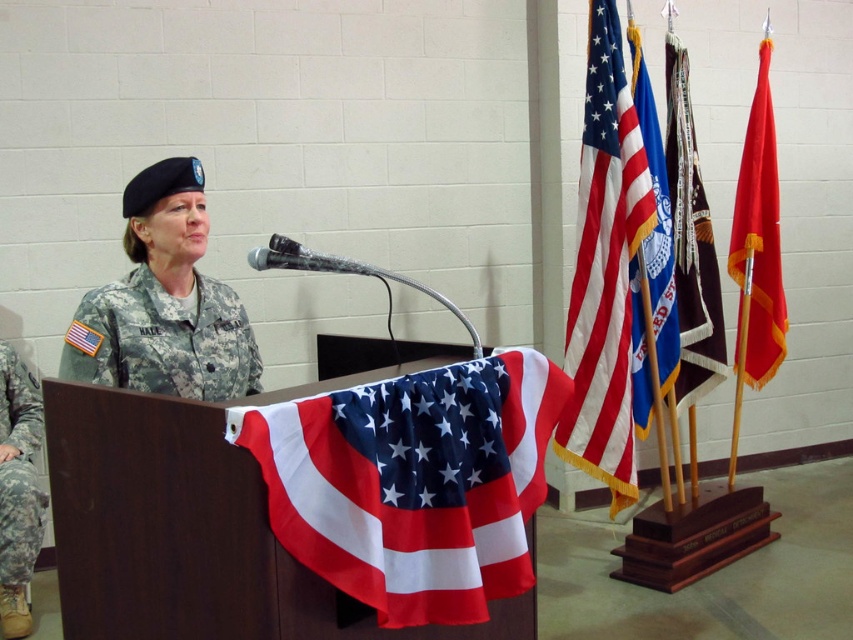
Question: Which point is closer to the camera taking this photo?

Choices:
 (A) (38, 541)
 (B) (149, 336)
 (C) (769, 310)

Answer: (B)

Question: Does american flag at upper right lie behind camouflage fabric uniform at left?

Choices:
 (A) yes
 (B) no

Answer: (A)

Question: Is american flag at upper right to the right of camouflage fabric uniform at left from the viewer's perspective?

Choices:
 (A) yes
 (B) no

Answer: (A)

Question: Which of the following is the farthest from the observer?

Choices:
 (A) (515, 424)
 (B) (688, 168)
 (C) (744, 326)
 (D) (132, 364)

Answer: (C)

Question: Is polyester american flag at center below camouflage fabric uniform at left?

Choices:
 (A) yes
 (B) no

Answer: (B)

Question: Estimate the real-world distances between objects in this image. Which object is farther from the polyester american flag at center?

Choices:
 (A) camouflage fabric uniform at left
 (B) american flag at upper right
 (C) camouflage fabric uniform at center
 (D) smooth red flag at right

Answer: (D)